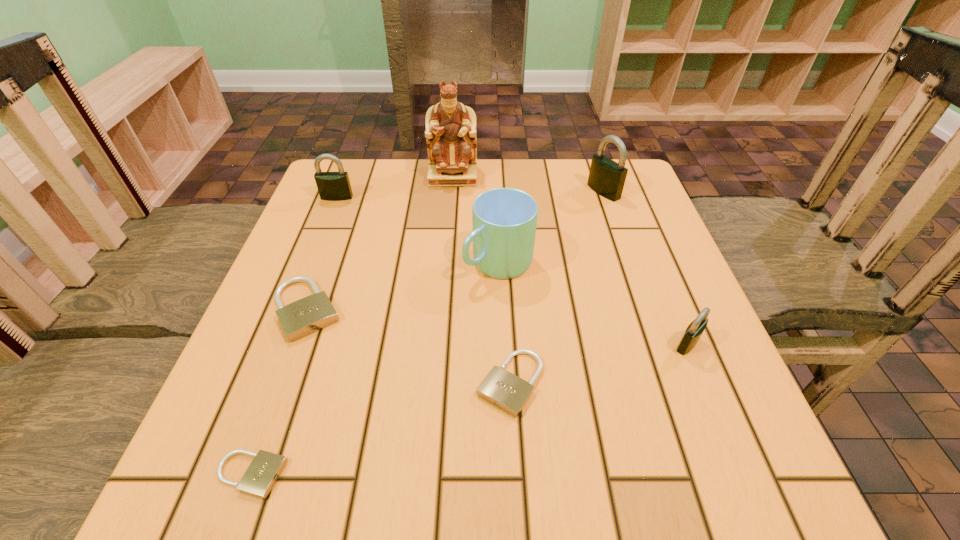
The image size is (960, 540). In the image, there is a desktop. Identify the location of vacant space at the near left corner. (251, 461).

Where is `vacant region between the second biggest black padlock and the biggest black padlock`? This screenshot has height=540, width=960. vacant region between the second biggest black padlock and the biggest black padlock is located at coordinates (470, 194).

The width and height of the screenshot is (960, 540). In order to click on vacant region between the fifth shortest object and the third shortest padlock in this screenshot , I will do `click(322, 253)`.

Identify the location of unoccupied area between the shortest padlock and the mug. This screenshot has width=960, height=540. (374, 368).

At what (x,y) coordinates should I click in order to perform the action: click on free spot between the figurine and the smallest beige padlock. Please return your answer as a coordinate pair (x, y). The image size is (960, 540). Looking at the image, I should click on (351, 326).

I want to click on vacant area that lies between the biggest black padlock and the smallest black padlock, so click(x=645, y=268).

Identify the location of free area in between the second shortest object and the fifth shortest object. This screenshot has width=960, height=540. (423, 290).

You are a GUI agent. You are given a task and a screenshot of the screen. Output one action in this format:
    pyautogui.click(x=<x>, y=<y>)
    Task: Click on the vacant space in between the biggest black padlock and the third padlock from right to left
    
    Given the screenshot: What is the action you would take?
    click(x=557, y=287)

Locate an element on the screen. Image resolution: width=960 pixels, height=540 pixels. free space that is in between the shortest object and the mug is located at coordinates (374, 368).

Identify the location of free spot between the nearest black padlock and the mug. The height and width of the screenshot is (540, 960). (593, 303).